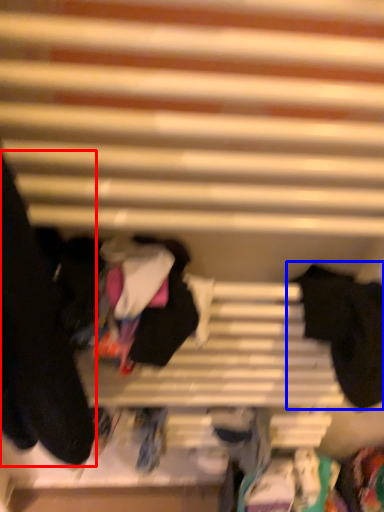
Question: Which of the following is the closest to the observer, clothing (highlighted by a red box) or clothing (highlighted by a blue box)?

Choices:
 (A) clothing
 (B) clothing

Answer: (A)